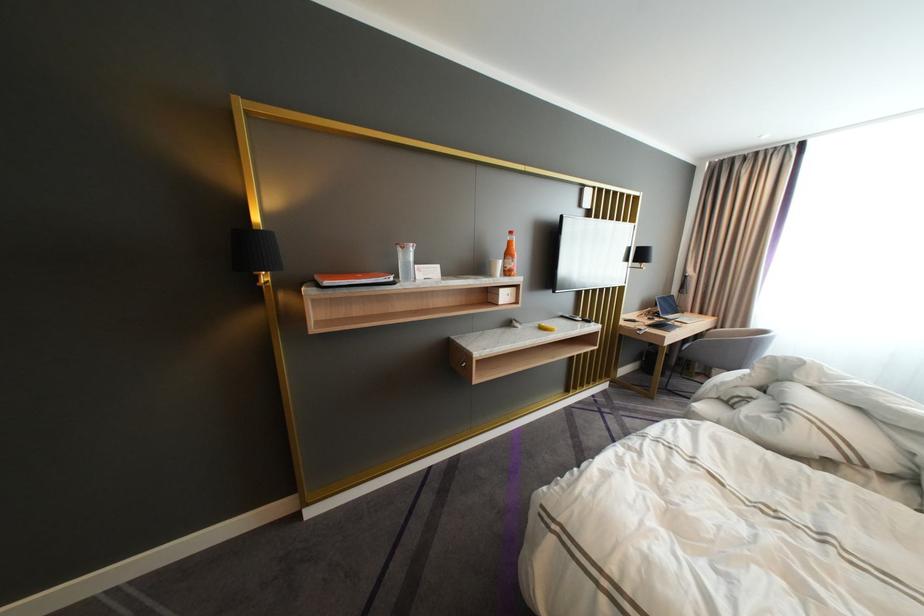
The height and width of the screenshot is (616, 924). Describe the element at coordinates (723, 342) in the screenshot. I see `the grey chair armrest` at that location.